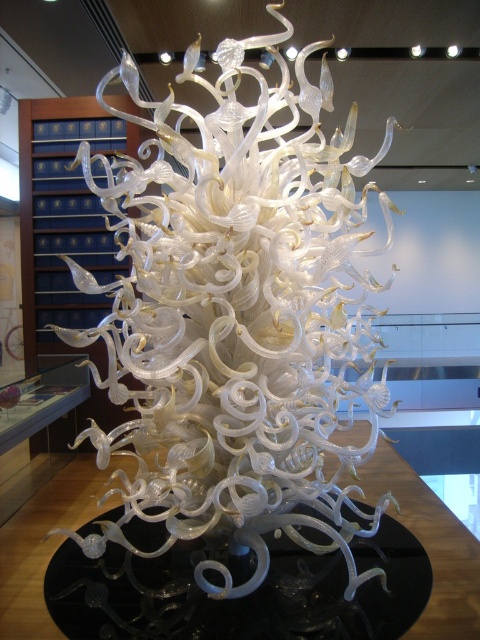
You are an art curator standing in front of the sculpture. You want to place a small decorative item on the black glass table at center. To do so, you need to step around the translucent glass sculpture at center. Is there enough space to move around the sculpture to reach the table?

The translucent glass sculpture at center is closer to the viewer than the black glass table at center, so there is enough space to move around the sculpture to reach the table.

Imagine you are standing in front of the glass sculpture. There are two points marked on it, one at coordinate point (267, 140) and the other at point (190, 589). Which point is closer to your eyes?

Point (267, 140) is further to the camera than point (190, 589), so the point closer to your eyes is point (190, 589).